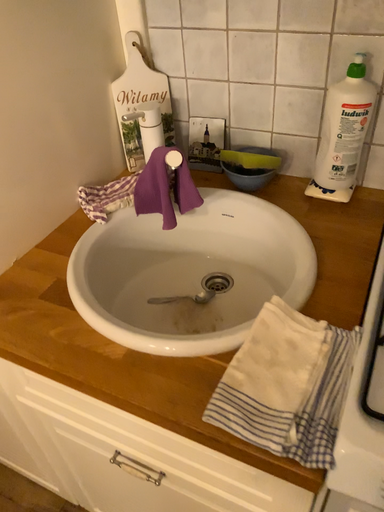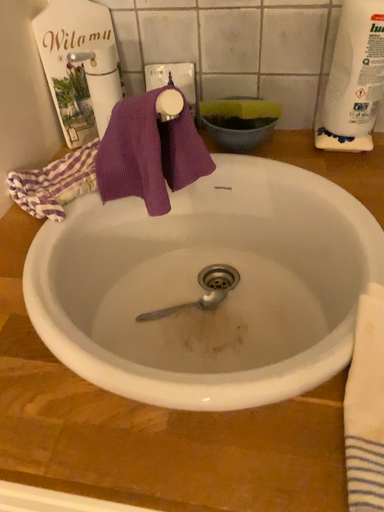
Question: Which way did the camera rotate in the video?

Choices:
 (A) rotated left
 (B) rotated right

Answer: (B)